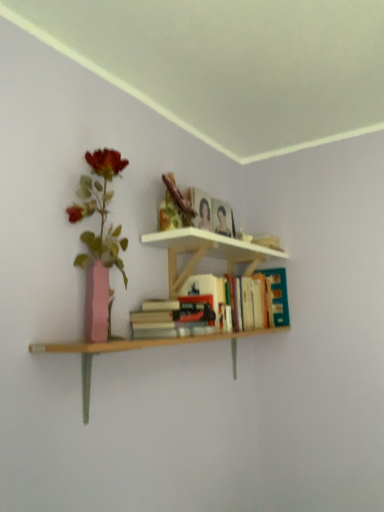
What do you see at coordinates (175, 314) in the screenshot? I see `hardcover book at upper right, which is the 1th book from back to front` at bounding box center [175, 314].

What do you see at coordinates (171, 317) in the screenshot? The height and width of the screenshot is (512, 384). I see `hardcover book at center, which ranks as the 1th book in front-to-back order` at bounding box center [171, 317].

At what (x,y) coordinates should I click in order to perform the action: click on hardcover book at upper center. Please return your answer as a coordinate pair (x, y). Image resolution: width=384 pixels, height=512 pixels. Looking at the image, I should click on (201, 209).

Is hardcover book at center, which ranks as the 1th book in front-to-back order, in contact with hardcover book at upper center?

hardcover book at center, which ranks as the 1th book in front-to-back order, is not next to hardcover book at upper center, and they're not touching.

From the image's perspective, is hardcover book at center, which ranks as the 1th book in front-to-back order, above or below hardcover book at upper center?

hardcover book at center, which ranks as the 1th book in front-to-back order, is situated lower than hardcover book at upper center in the image.

Is hardcover book at center, which ranks as the 1th book in front-to-back order, wider or thinner than hardcover book at upper center?

Considering their sizes, hardcover book at center, which ranks as the 1th book in front-to-back order, looks broader than hardcover book at upper center.

Image resolution: width=384 pixels, height=512 pixels. What are the coordinates of `paperback book behind the hardcover book at center, acting as the 2th book starting from the back` in the screenshot? It's located at click(201, 209).

Is point (197, 315) less distant than point (192, 189)?

Yes, it is in front of point (192, 189).

From the image's perspective, is hardcover book at upper right, the second book when ordered from front to back, beneath hardcover book at upper center?

Yes, from the image's perspective, hardcover book at upper right, the second book when ordered from front to back, is below hardcover book at upper center.

Based on the photo, how distant is hardcover book at upper right, the second book when ordered from front to back, from hardcover book at upper center?

The distance of hardcover book at upper right, the second book when ordered from front to back, from hardcover book at upper center is 12.85 inches.

From the picture: Can we say hardcover book at upper right, which is the 1th book from back to front, lies outside hardcover book at upper center?

Yes, hardcover book at upper right, which is the 1th book from back to front, is outside of hardcover book at upper center.

Is hardcover book at center, which ranks as the 1th book in front-to-back order, outside of hardcover book at upper right, the second book when ordered from front to back?

hardcover book at center, which ranks as the 1th book in front-to-back order, is positioned outside hardcover book at upper right, the second book when ordered from front to back.

Considering the sizes of objects hardcover book at center, acting as the 2th book starting from the back, and hardcover book at upper right, the second book when ordered from front to back, in the image provided, who is smaller, hardcover book at center, acting as the 2th book starting from the back, or hardcover book at upper right, the second book when ordered from front to back,?

hardcover book at center, acting as the 2th book starting from the back, is smaller.

Considering the relative sizes of hardcover book at center, which ranks as the 1th book in front-to-back order, and hardcover book at upper right, which is the 1th book from back to front, in the image provided, is hardcover book at center, which ranks as the 1th book in front-to-back order, wider than hardcover book at upper right, which is the 1th book from back to front,?

Answer: No, hardcover book at center, which ranks as the 1th book in front-to-back order, is not wider than hardcover book at upper right, which is the 1th book from back to front.

Considering the relative sizes of hardcover book at center, acting as the 2th book starting from the back, and hardcover book at upper right, the second book when ordered from front to back, in the image provided, is hardcover book at center, acting as the 2th book starting from the back, shorter than hardcover book at upper right, the second book when ordered from front to back,?

Yes.

In the scene shown: Which object is further away from the camera taking this photo, hardcover book at upper center or hardcover book at upper right, the second book when ordered from front to back?

Positioned behind is hardcover book at upper center.

From the picture: Is hardcover book at upper center to the left of hardcover book at upper right, the second book when ordered from front to back, from the viewer's perspective?

Yes, hardcover book at upper center is to the left of hardcover book at upper right, the second book when ordered from front to back.

Is hardcover book at upper center oriented away from hardcover book at upper right, which is the 1th book from back to front?

That's not correct — hardcover book at upper center is not looking away from hardcover book at upper right, which is the 1th book from back to front.

Does hardcover book at upper center have a greater width compared to hardcover book at upper right, the second book when ordered from front to back?

No.

Considering the sizes of hardcover book at upper right, the second book when ordered from front to back, and hardcover book at center, acting as the 2th book starting from the back, in the image, is hardcover book at upper right, the second book when ordered from front to back, bigger or smaller than hardcover book at center, acting as the 2th book starting from the back,?

In the image, hardcover book at upper right, the second book when ordered from front to back, appears to be larger than hardcover book at center, acting as the 2th book starting from the back.

From a real-world perspective, is hardcover book at upper right, the second book when ordered from front to back, above or below hardcover book at center, which ranks as the 1th book in front-to-back order?

In terms of real-world spatial position, hardcover book at upper right, the second book when ordered from front to back, is above hardcover book at center, which ranks as the 1th book in front-to-back order.

Could you measure the distance between hardcover book at upper right, the second book when ordered from front to back, and hardcover book at center, acting as the 2th book starting from the back?

hardcover book at upper right, the second book when ordered from front to back, and hardcover book at center, acting as the 2th book starting from the back, are 9.06 centimeters apart.

Is hardcover book at upper right, the second book when ordered from front to back, situated inside hardcover book at center, acting as the 2th book starting from the back, or outside?

The correct answer is: outside.

Is point (207, 199) less distant than point (205, 319)?

No, (207, 199) is behind (205, 319).

From the image's perspective, is hardcover book at upper center above or below hardcover book at center, which ranks as the 1th book in front-to-back order?

Clearly, from the image's perspective, hardcover book at upper center is above hardcover book at center, which ranks as the 1th book in front-to-back order.

Where is `paperback book on the right side of hardcover book at center, acting as the 2th book starting from the back`? paperback book on the right side of hardcover book at center, acting as the 2th book starting from the back is located at coordinates (201, 209).

From the image's perspective, count 1st books downward from the hardcover book at upper center and point to it. Please provide its 2D coordinates.

[(175, 314)]

Which object lies further to the anchor point hardcover book at upper center, hardcover book at center, acting as the 2th book starting from the back, or hardcover book at upper right, the second book when ordered from front to back?

hardcover book at center, acting as the 2th book starting from the back.

From the image, which object appears to be nearer to hardcover book at upper center, hardcover book at upper right, the second book when ordered from front to back, or hardcover book at center, which ranks as the 1th book in front-to-back order?

hardcover book at upper right, the second book when ordered from front to back, lies closer to hardcover book at upper center than the other object.

Looking at the image, which one is located closer to hardcover book at upper right, the second book when ordered from front to back, hardcover book at upper center or hardcover book at center, which ranks as the 1th book in front-to-back order?

hardcover book at center, which ranks as the 1th book in front-to-back order, lies closer to hardcover book at upper right, the second book when ordered from front to back, than the other object.

Based on their spatial positions, is hardcover book at upper center or hardcover book at upper right, the second book when ordered from front to back, further from hardcover book at center, acting as the 2th book starting from the back?

Based on the image, hardcover book at upper center appears to be further to hardcover book at center, acting as the 2th book starting from the back.

Based on their spatial positions, is hardcover book at center, which ranks as the 1th book in front-to-back order, or hardcover book at upper center closer to hardcover book at upper right, the second book when ordered from front to back?

Among the two, hardcover book at center, which ranks as the 1th book in front-to-back order, is located nearer to hardcover book at upper right, the second book when ordered from front to back.

Estimate the real-world distances between objects in this image. Which object is closer to hardcover book at center, acting as the 2th book starting from the back, hardcover book at upper right, the second book when ordered from front to back, or hardcover book at upper center?

hardcover book at upper right, the second book when ordered from front to back.

Locate an element on the screen. This screenshot has width=384, height=512. book between hardcover book at upper center and hardcover book at center, which ranks as the 1th book in front-to-back order, in the up-down direction is located at coordinates (175, 314).